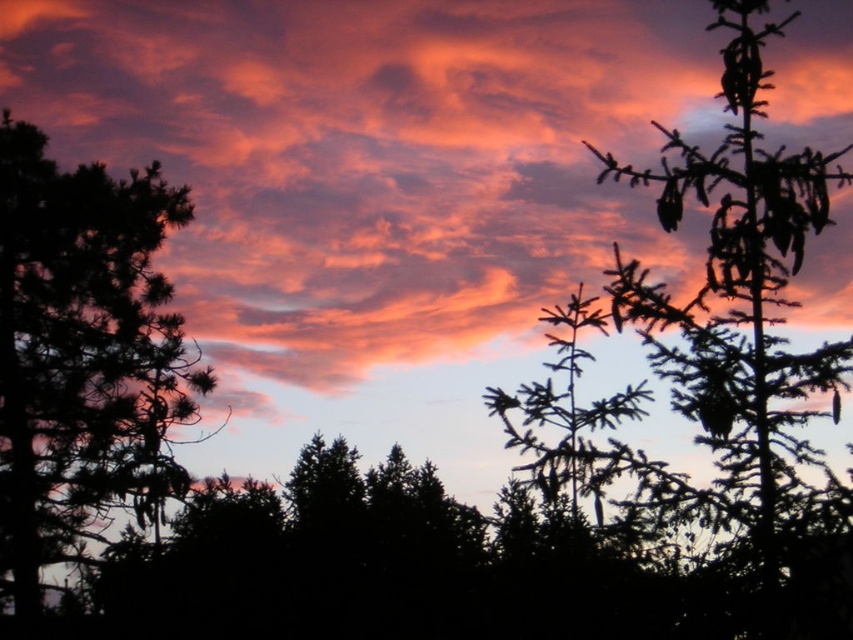
You are an artist painting the sunset scene. You want to place a small bird between the orange cotton cloud at upper center and the silhouette pine at right. Based on their positions, which object should the bird be closer to?

The orange cotton cloud at upper center is to the left of silhouette pine at right, so the bird should be placed closer to the orange cotton cloud at upper center since it is positioned to the left of the pine.

You are a photographer trying to capture the sunset scene. You want to place a small drone at the center of the image to take aerial shots. Given that the silhouette tree at left is at a specific coordinate, will the drone interfere with the tree when positioned at the center?

The silhouette tree at left is located at coordinate point (83,356), which is not at the center of the image. Therefore, placing the drone at the center will not interfere with the silhouette tree at left.